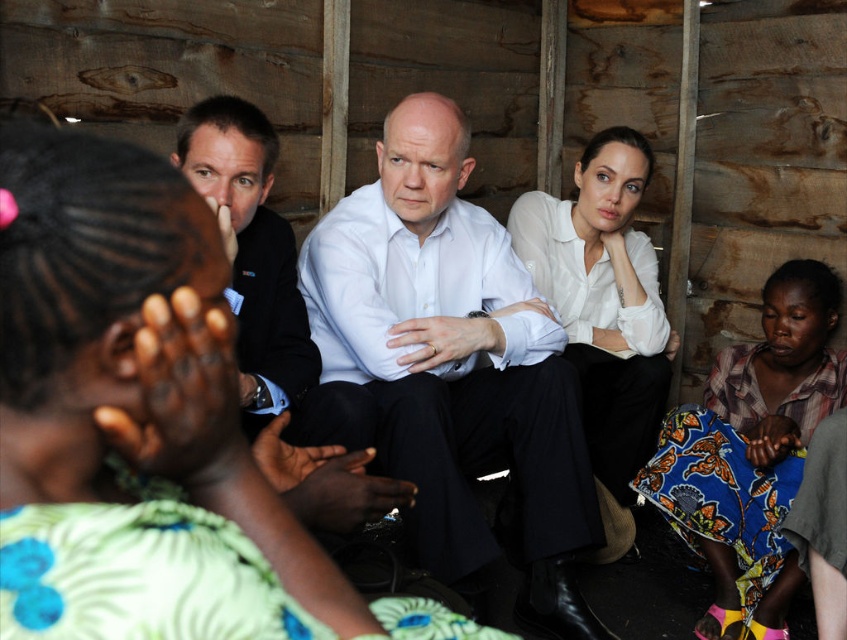
In the scene shown: Looking at the scene, which object is positioned to the left of the other between the white smooth shirt at center and the printed fabric dress at lower right?

The white smooth shirt at center is to the left of the printed fabric dress at lower right.

Based on the scene description, where exactly is the white smooth shirt at center located in terms of coordinates?

The white smooth shirt at center is located at coordinates point [454,364].